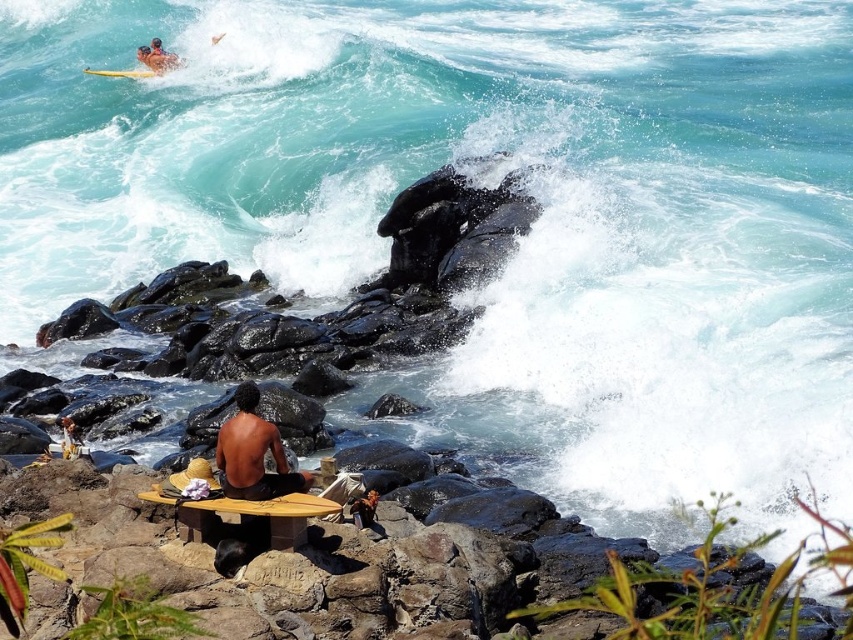
From the picture: You are a photographer trying to capture the man and his belongings in the scene. The shiny black skin at center and the yellow foam surfboard at upper left are both in your viewfinder. Which object is closer to the camera based on their positions?

The shiny black skin at center is positioned under the yellow foam surfboard at upper left, so the yellow foam surfboard at upper left is closer to the camera.

You are standing at the point closer to the camera in the image. Which point are you at, point (244, 484) or point (152, 74)?

You are at point (244, 484) because it is closer to the camera than point (152, 74).

You are a photographer planning to take a photo of the wooden surfboard at lower center and the yellow foam surfboard at upper left. Which surfboard should you focus on first if you want to capture both in a single frame without moving the camera?

You should focus on the yellow foam surfboard at upper left first because the wooden surfboard at lower center is positioned to its right, meaning they are both within the frame if you start with the leftmost object.